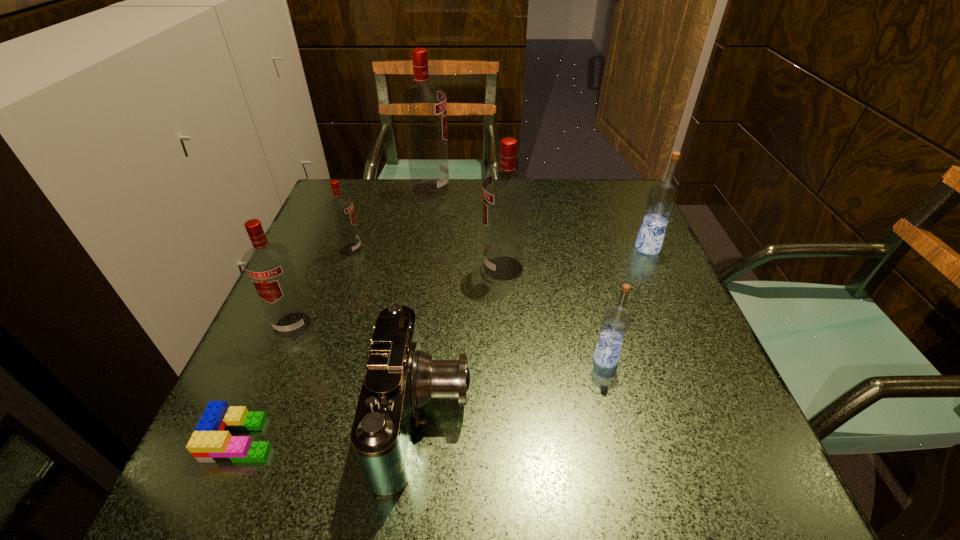
You are a GUI agent. You are given a task and a screenshot of the screen. Output one action in this format:
    pyautogui.click(x=<x>, y=<y>)
    Task: Click on the vacant space that satisfies the following two spatial constraints: 1. on the front label of the sixth object from left to right; 2. on the front label of the fifth farthest vodka
    
    Given the screenshot: What is the action you would take?
    pyautogui.click(x=507, y=325)

Image resolution: width=960 pixels, height=540 pixels. Identify the location of free spot that satisfies the following two spatial constraints: 1. on the front label of the farthest vodka; 2. on the front label of the nearest red vodka. (409, 325).

This screenshot has height=540, width=960. I want to click on vacant space that satisfies the following two spatial constraints: 1. on the front label of the tallest object; 2. on the front side of the Lego, so click(x=391, y=438).

Where is `vacant space that satisfies the following two spatial constraints: 1. on the back side of the left blue vodka; 2. on the left side of the farther blue vodka`? Image resolution: width=960 pixels, height=540 pixels. vacant space that satisfies the following two spatial constraints: 1. on the back side of the left blue vodka; 2. on the left side of the farther blue vodka is located at coordinates (576, 248).